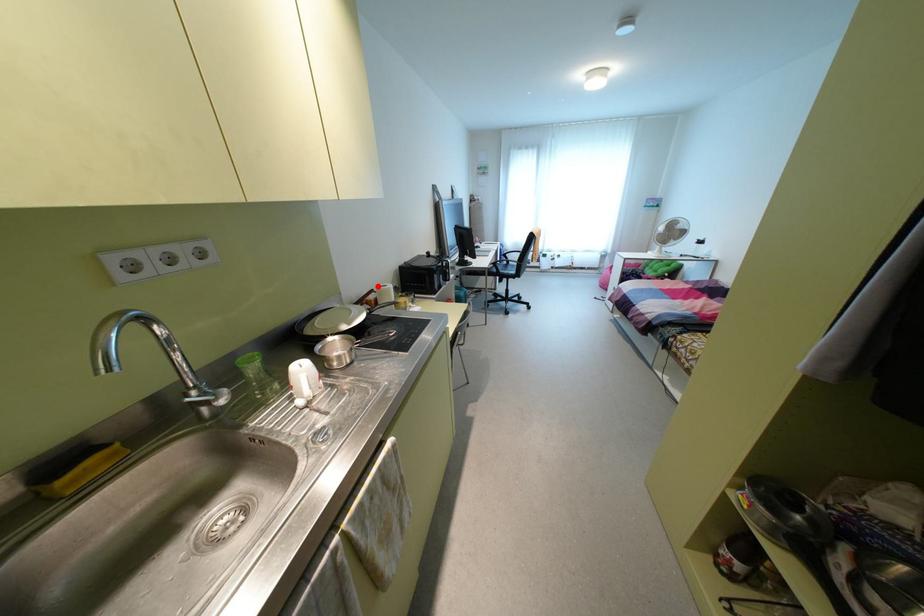
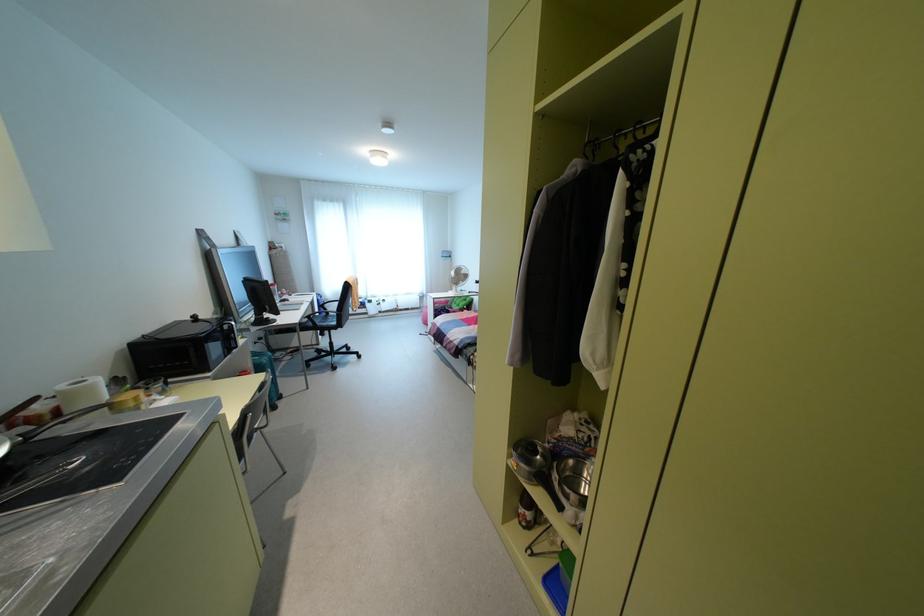
Find the pixel in the second image that matches the highlighted location in the first image.

(62, 387)